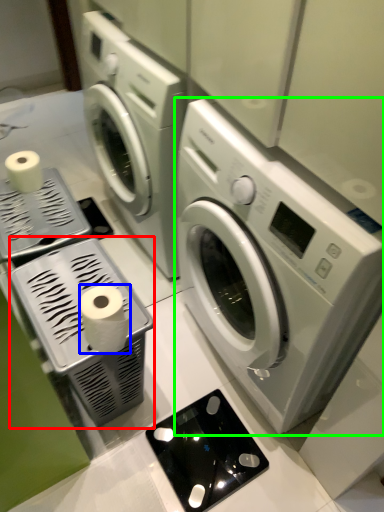
Question: Considering the real-world distances, which object is closest to appliance (highlighted by a red box)? toilet paper (highlighted by a blue box) or washing machine (highlighted by a green box).

Choices:
 (A) toilet paper
 (B) washing machine

Answer: (A)